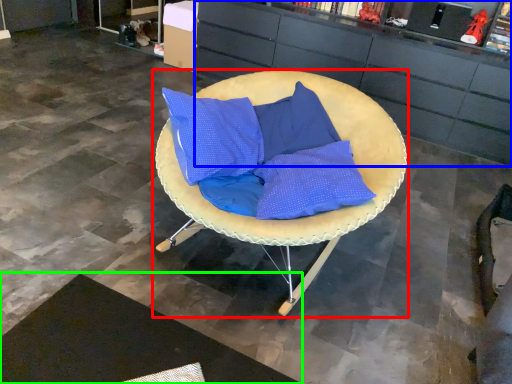
Question: Estimate the real-world distances between objects in this image. Which object is closer to chair (highlighted by a red box), cabinetry (highlighted by a blue box) or mat (highlighted by a green box)?

Choices:
 (A) cabinetry
 (B) mat

Answer: (B)